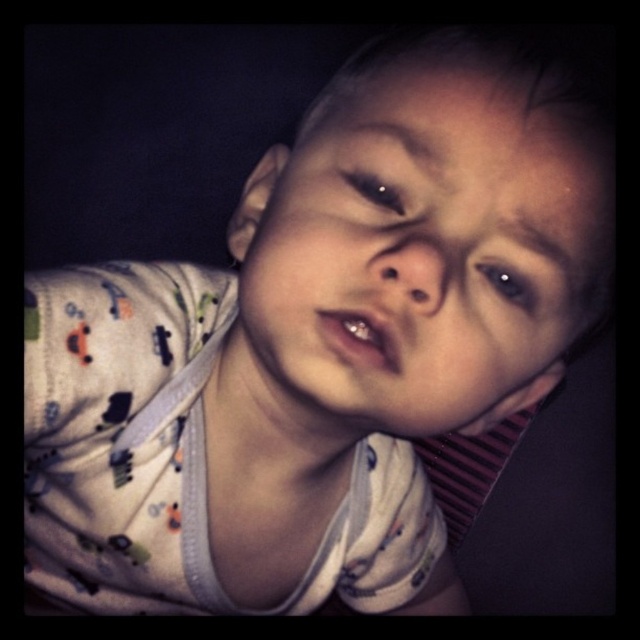
Question: Can you confirm if brown glossy eye at upper center is positioned below black glossy eye at upper center?

Choices:
 (A) no
 (B) yes

Answer: (B)

Question: Can you confirm if smooth skin face at center is positioned to the left of brown glossy eye at upper center?

Choices:
 (A) no
 (B) yes

Answer: (B)

Question: Can you confirm if brown glossy eye at upper center is thinner than black glossy eye at upper center?

Choices:
 (A) yes
 (B) no

Answer: (B)

Question: Which of the following is the closest to the observer?

Choices:
 (A) (390, 90)
 (B) (381, 180)

Answer: (B)

Question: Based on their relative distances, which object is farther from the brown glossy eye at upper center?

Choices:
 (A) black glossy eye at upper center
 (B) smooth skin face at center

Answer: (B)

Question: Estimate the real-world distances between objects in this image. Which object is closer to the black glossy eye at upper center?

Choices:
 (A) smooth skin face at center
 (B) brown glossy eye at upper center

Answer: (B)